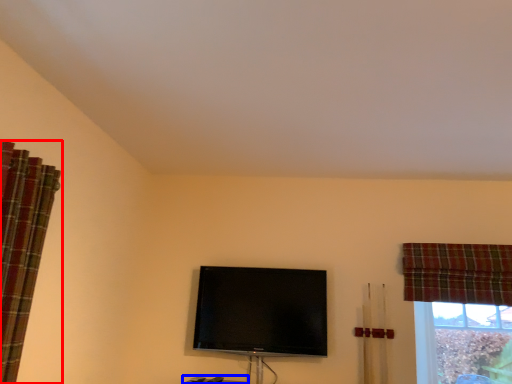
Question: Which of the following is the farthest to the observer, curtain (highlighted by a red box) or furniture (highlighted by a blue box)?

Choices:
 (A) curtain
 (B) furniture

Answer: (B)